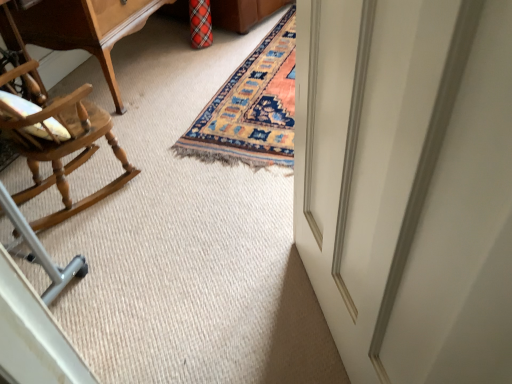
Question: Is wooden table at upper left positioned far away from light brown wood rocking chair at left?

Choices:
 (A) no
 (B) yes

Answer: (A)

Question: Is wooden table at upper left surrounding light brown wood rocking chair at left?

Choices:
 (A) yes
 (B) no

Answer: (B)

Question: Is wooden table at upper left at the left side of light brown wood rocking chair at left?

Choices:
 (A) no
 (B) yes

Answer: (B)

Question: Is wooden table at upper left looking in the opposite direction of light brown wood rocking chair at left?

Choices:
 (A) yes
 (B) no

Answer: (B)

Question: From a real-world perspective, is wooden table at upper left under light brown wood rocking chair at left?

Choices:
 (A) no
 (B) yes

Answer: (B)

Question: From a real-world perspective, is white glossy door at right physically located above or below wooden table at upper left?

Choices:
 (A) above
 (B) below

Answer: (A)

Question: Do you think white glossy door at right is within wooden table at upper left, or outside of it?

Choices:
 (A) inside
 (B) outside

Answer: (B)

Question: Relative to wooden table at upper left, is white glossy door at right in front or behind?

Choices:
 (A) front
 (B) behind

Answer: (A)

Question: Is white glossy door at right taller or shorter than wooden table at upper left?

Choices:
 (A) short
 (B) tall

Answer: (B)

Question: Considering the relative positions of light brown wood rocking chair at left and wooden table at upper left in the image provided, is light brown wood rocking chair at left to the left or to the right of wooden table at upper left?

Choices:
 (A) right
 (B) left

Answer: (A)

Question: Considering the positions of point (59, 109) and point (130, 3), is point (59, 109) closer or farther from the camera than point (130, 3)?

Choices:
 (A) closer
 (B) farther

Answer: (A)

Question: From a real-world perspective, relative to wooden table at upper left, is light brown wood rocking chair at left vertically above or below?

Choices:
 (A) below
 (B) above

Answer: (B)

Question: Which is correct: light brown wood rocking chair at left is inside wooden table at upper left, or outside of it?

Choices:
 (A) outside
 (B) inside

Answer: (A)

Question: Is white glossy door at right inside or outside of light brown wood rocking chair at left?

Choices:
 (A) outside
 (B) inside

Answer: (A)

Question: From the image's perspective, relative to light brown wood rocking chair at left, is white glossy door at right above or below?

Choices:
 (A) below
 (B) above

Answer: (A)